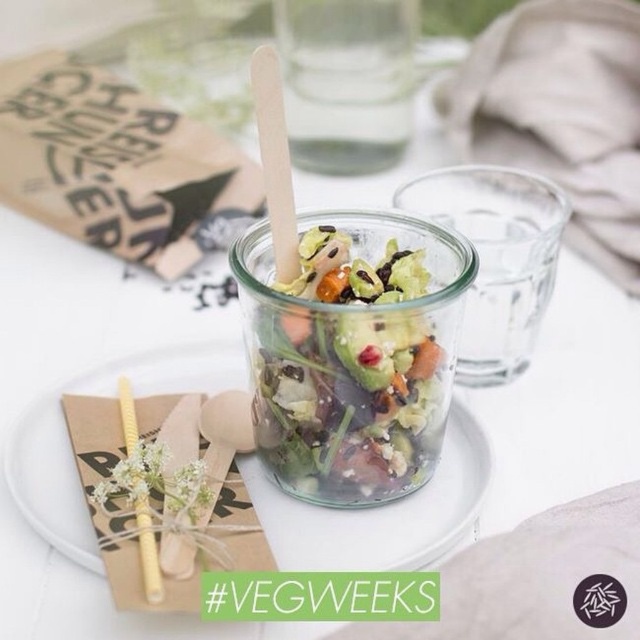
Looking at this image, you are sitting at the table and want to place a napkin on the clear glass plate at center. To do this, do you need to move the clear glass jar at center first?

The clear glass plate at center is in front of the clear glass jar at center, so you can place the napkin on the clear glass plate at center without moving the clear glass jar at center.

From the picture: You are setting up a meal on a table and want to place a salad in the clear glass jar at center. Where should you put the clear glass plate at center relative to the jar?

The clear glass plate at center should be placed below the clear glass jar at center as per the setup.